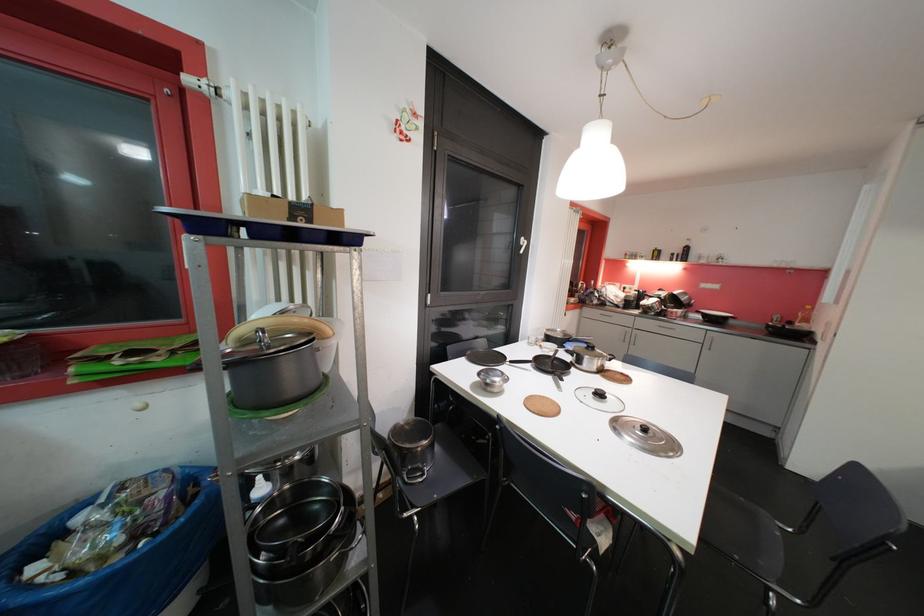
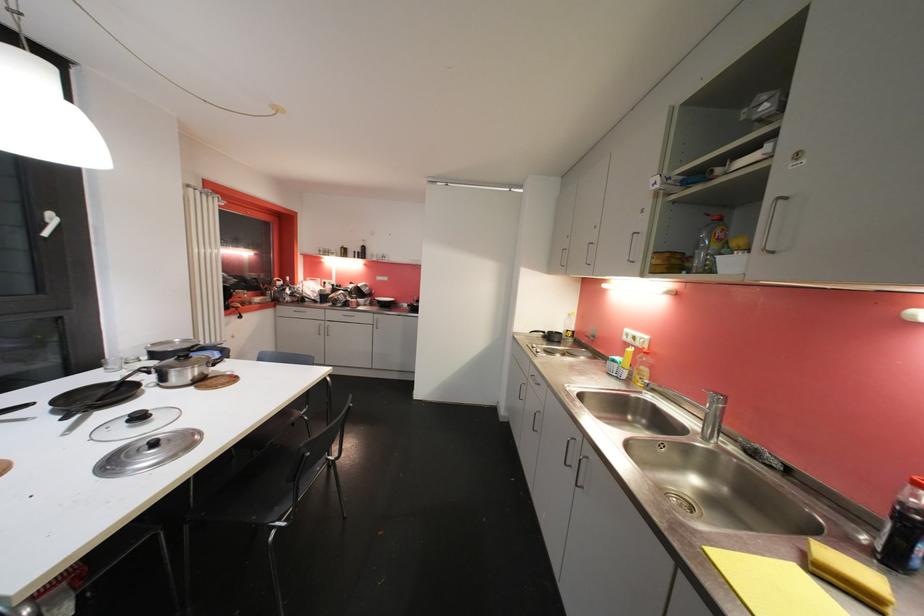
Question: How did the camera likely rotate?

Choices:
 (A) Left
 (B) Right
 (C) Up
 (D) Down

Answer: (B)